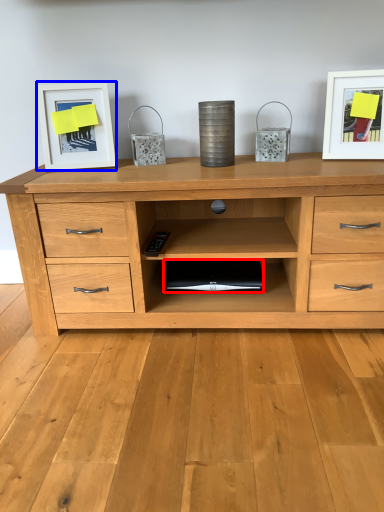
Question: Which point is further to the camera, computer (highlighted by a red box) or picture frame (highlighted by a blue box)?

Choices:
 (A) computer
 (B) picture frame

Answer: (A)